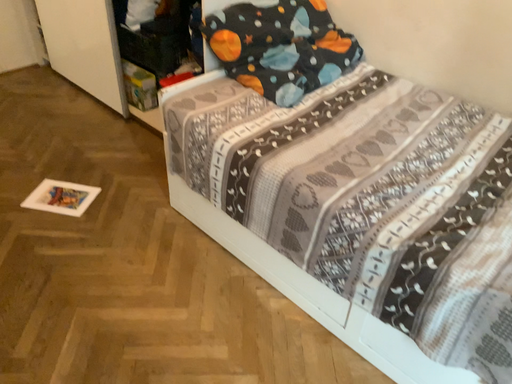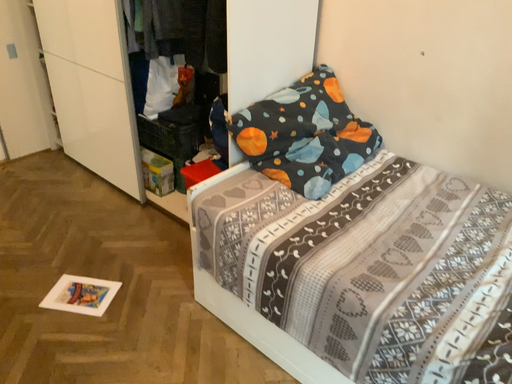
Question: How did the camera likely rotate when shooting the video?

Choices:
 (A) rotated downward
 (B) rotated upward

Answer: (B)